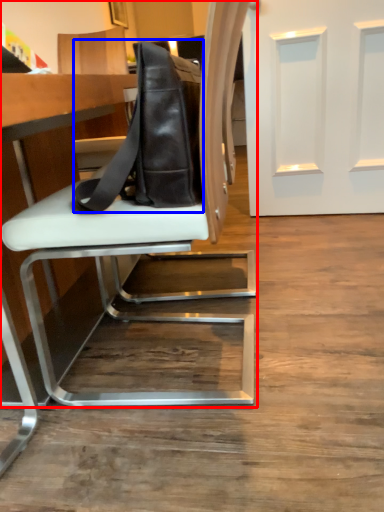
Question: Which point is closer to the camera, chair (highlighted by a red box) or messenger bag (highlighted by a blue box)?

Choices:
 (A) chair
 (B) messenger bag

Answer: (A)